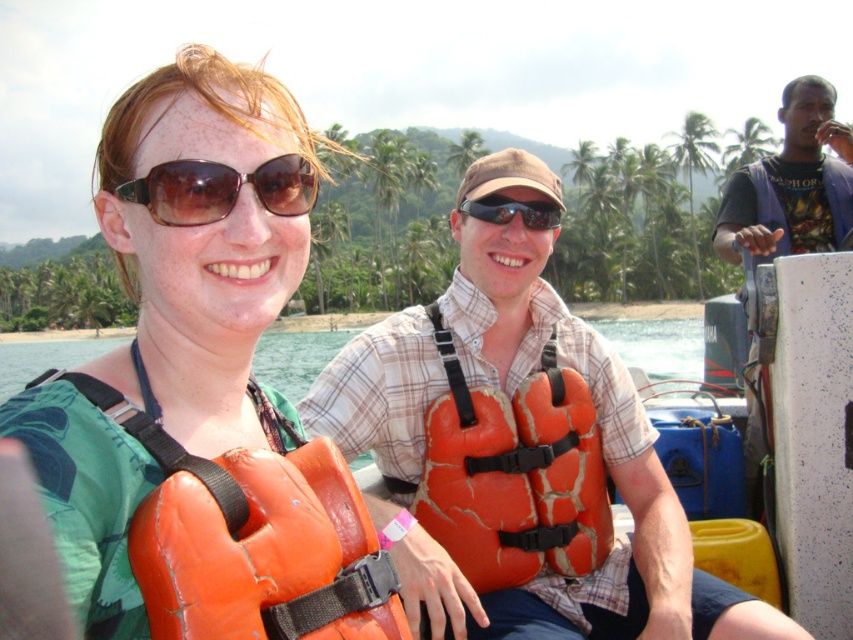
You are standing on the boat and want to move from the point at coordinates point (828, 189) to the point at coordinates point (508, 202). Which direction should you move to get closer to the shore?

Since point (828, 189) is further to the viewer than point (508, 202), you should move towards the point (508, 202), which is closer to the shore.

You are standing on the boat and see two points marked on the water. The first point is at coordinates point [531,429] and the second is at point [218,188]. If you want to throw a buoy to the point that is further away from you, which coordinate should you aim for?

Point [531,429] is behind point [218,188], so you should aim for point [531,429] as it is further away from your position on the boat.

You are a safety inspector checking the equipment on the boat. You see the orange cracked life jacket at center and the brown reflective sunglasses at upper left. Which item is wider?

The orange cracked life jacket at center is wider than the brown reflective sunglasses at upper left.